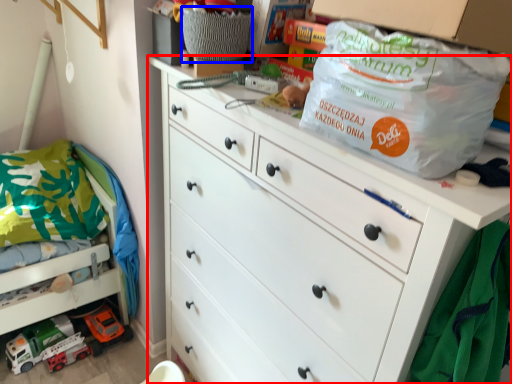
Question: Which point is closer to the camera, chest of drawers (highlighted by a red box) or basket (highlighted by a blue box)?

Choices:
 (A) chest of drawers
 (B) basket

Answer: (A)